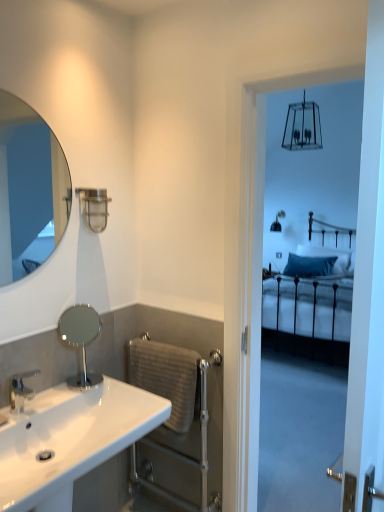
Question: Is matte silver mirror at upper left, marked as the 1th mirror in a top-to-bottom arrangement, not close to silver metallic towel rail at lower center?

Choices:
 (A) no
 (B) yes

Answer: (B)

Question: Can you confirm if matte silver mirror at upper left, the 2th mirror ordered from the bottom, is taller than silver metallic towel rail at lower center?

Choices:
 (A) no
 (B) yes

Answer: (A)

Question: Considering the relative positions of matte silver mirror at upper left, the 2th mirror ordered from the bottom, and silver metallic towel rail at lower center in the image provided, is matte silver mirror at upper left, the 2th mirror ordered from the bottom, to the right of silver metallic towel rail at lower center from the viewer's perspective?

Choices:
 (A) yes
 (B) no

Answer: (B)

Question: Is silver metallic towel rail at lower center surrounded by matte silver mirror at upper left, the 2th mirror ordered from the bottom?

Choices:
 (A) yes
 (B) no

Answer: (B)

Question: From a real-world perspective, does matte silver mirror at upper left, marked as the 1th mirror in a top-to-bottom arrangement, sit lower than silver metallic towel rail at lower center?

Choices:
 (A) yes
 (B) no

Answer: (B)

Question: Does matte silver mirror at upper left, marked as the 1th mirror in a top-to-bottom arrangement, have a lesser height compared to silver metallic towel rail at lower center?

Choices:
 (A) no
 (B) yes

Answer: (B)

Question: Does blue velvet pillow at center have a larger size compared to silver metallic faucet at lower left?

Choices:
 (A) yes
 (B) no

Answer: (A)

Question: From the image's perspective, is blue velvet pillow at center on top of silver metallic faucet at lower left?

Choices:
 (A) no
 (B) yes

Answer: (B)

Question: Considering the relative sizes of blue velvet pillow at center and silver metallic faucet at lower left in the image provided, is blue velvet pillow at center smaller than silver metallic faucet at lower left?

Choices:
 (A) no
 (B) yes

Answer: (A)

Question: From a real-world perspective, is blue velvet pillow at center on top of silver metallic faucet at lower left?

Choices:
 (A) yes
 (B) no

Answer: (B)

Question: From a real-world perspective, is blue velvet pillow at center below silver metallic faucet at lower left?

Choices:
 (A) no
 (B) yes

Answer: (B)

Question: Is blue velvet pillow at center oriented away from silver metallic faucet at lower left?

Choices:
 (A) no
 (B) yes

Answer: (A)

Question: Is the depth of gray textured towel bar at lower center greater than that of white glossy sink at lower left?

Choices:
 (A) yes
 (B) no

Answer: (A)